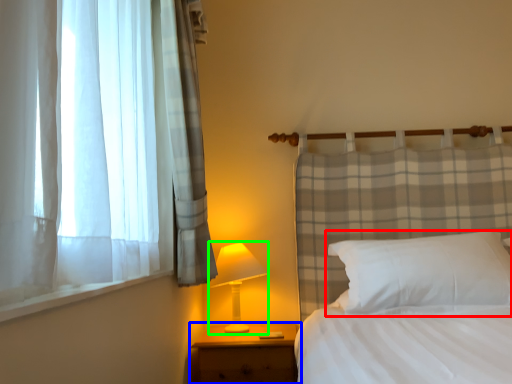
Question: Which object is positioned closest to pillow (highlighted by a red box)? Select from nightstand (highlighted by a blue box) and table lamp (highlighted by a green box).

Choices:
 (A) nightstand
 (B) table lamp

Answer: (A)